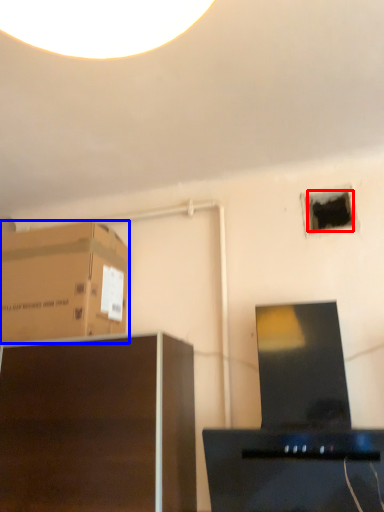
Question: Which object appears closest to the camera in this image, hole (highlighted by a red box) or cardboard box (highlighted by a blue box)?

Choices:
 (A) hole
 (B) cardboard box

Answer: (B)